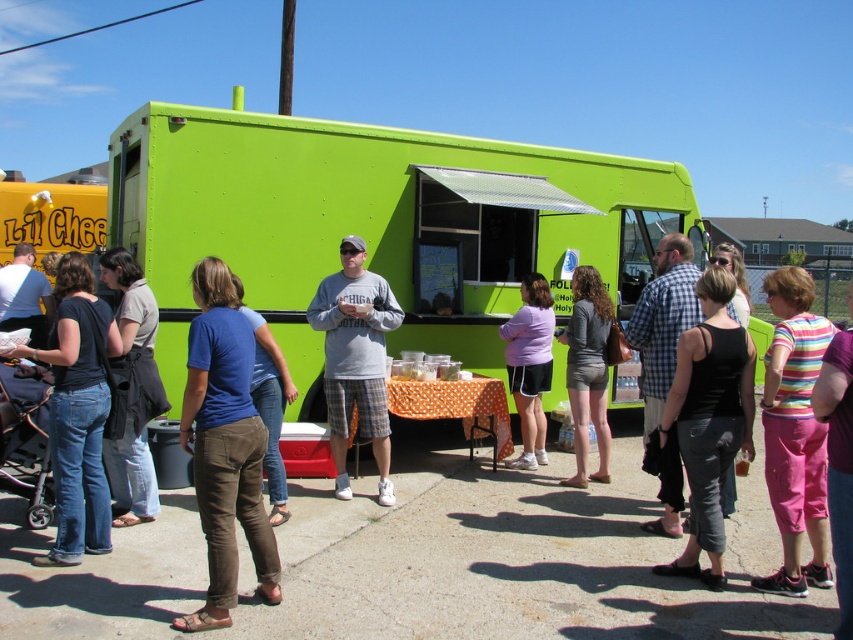
You are a photographer trying to capture a clear shot of the gray cotton shirt at center. Based on the coordinates provided, where should you position your camera to ensure the subject is in the frame?

The gray cotton shirt at center is located at coordinates point (355,358), so positioning the camera at that point will ensure the subject is centered in the frame.

You are a customer standing at the edge of the scene. You want to approach the green matte food truck at center to order food. Is the gray cotton shirt at center blocking your path to the food truck?

The green matte food truck at center is above the gray cotton shirt at center, so the gray cotton shirt at center is not blocking your path to the food truck.

You are a photographer trying to capture a clear shot of the gray cotton shirt at center and the gray matte shorts at center. Since you want to focus on the clothing items, which one should you zoom in on more to ensure it appears larger in your photo?

The gray cotton shirt at center is bigger than the gray matte shorts at center, so you should zoom in more on the gray cotton shirt at center to ensure it appears larger in your photo.